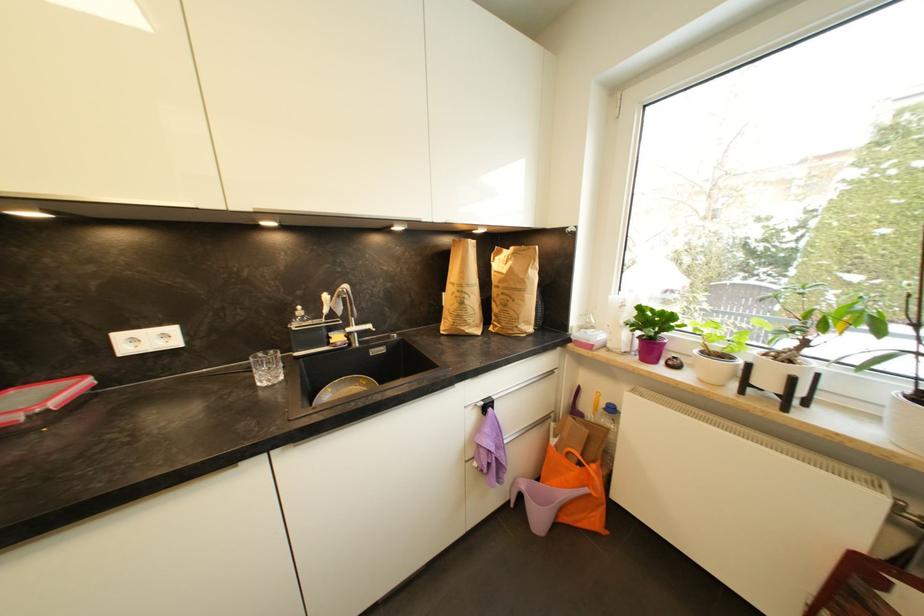
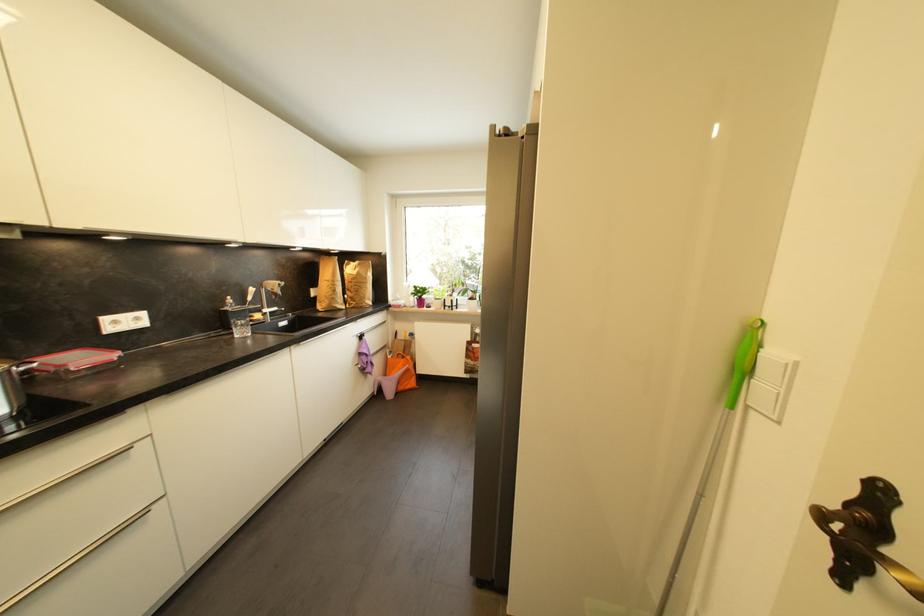
The point at (467, 305) is marked in the first image. Where is the corresponding point in the second image?

(339, 293)